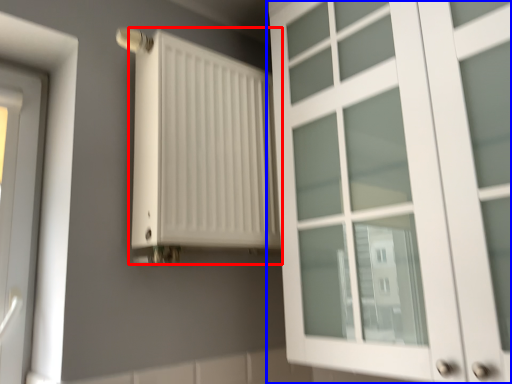
Question: Which point is closer to the camera, radiator (highlighted by a red box) or cupboard (highlighted by a blue box)?

Choices:
 (A) radiator
 (B) cupboard

Answer: (B)